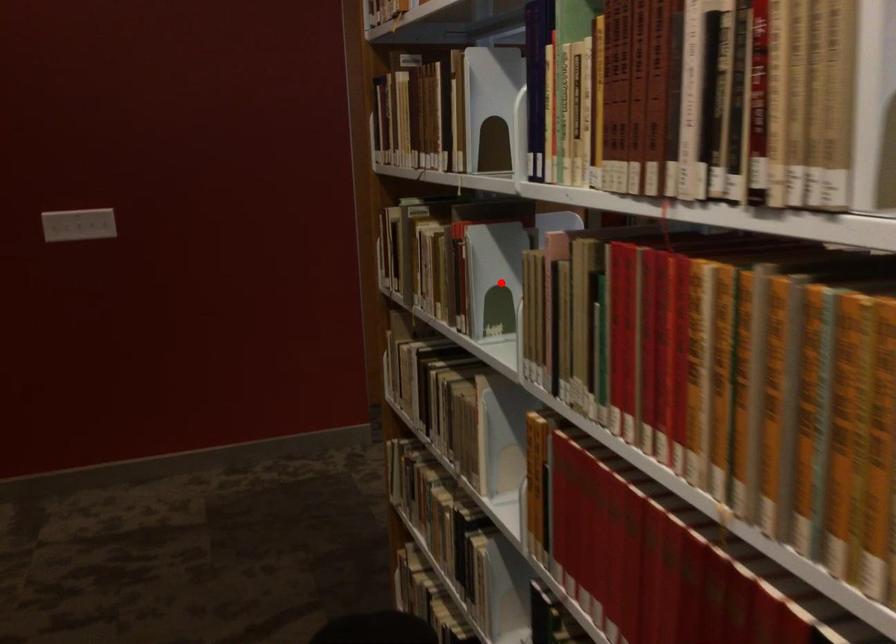
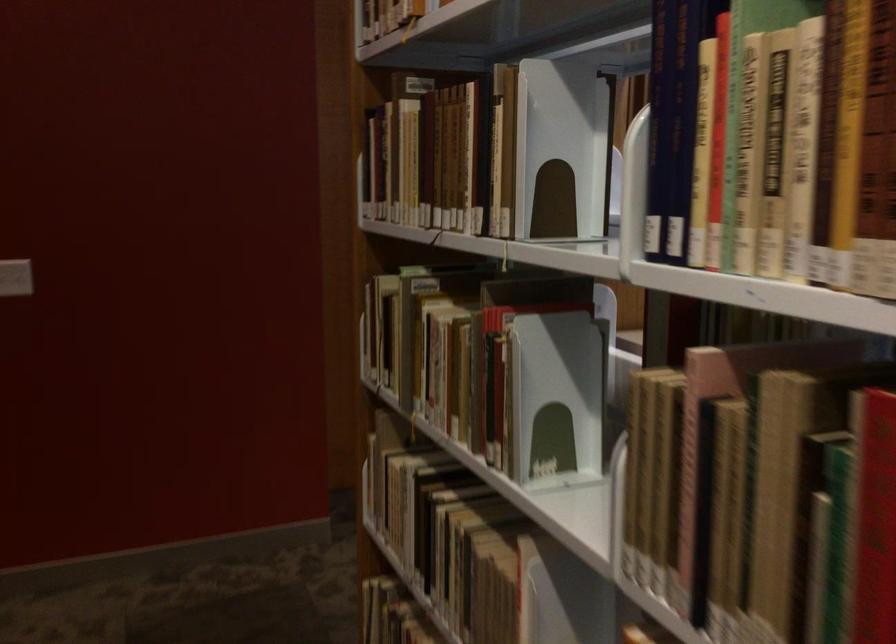
The point at the highlighted location is marked in the first image. Where is the corresponding point in the second image?

(556, 398)